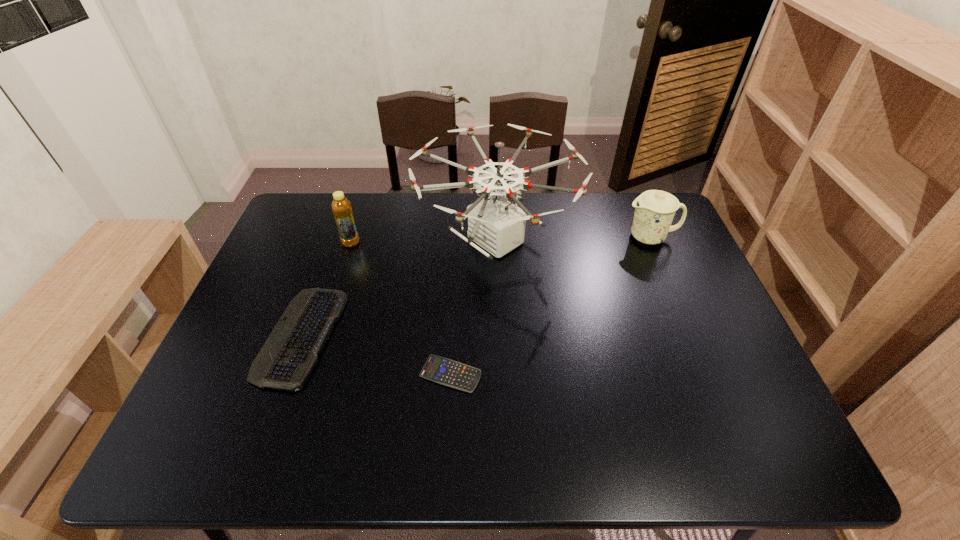
Where is `free space between the bottle and the calculator`? free space between the bottle and the calculator is located at coordinates 400,308.

Locate which object is the closest to the shortest object. Please provide its 2D coordinates. Your answer should be formatted as a tuple, i.e. [(x, y)], where the tuple contains the x and y coordinates of a point satisfying the conditions above.

[(497, 225)]

The width and height of the screenshot is (960, 540). What are the coordinates of `object that is the closest to the rightmost object` in the screenshot? It's located at point(497,225).

The width and height of the screenshot is (960, 540). I want to click on vacant point that satisfies the following two spatial constraints: 1. on the front side of the shortest object; 2. on the right side of the bottle, so click(x=309, y=374).

The width and height of the screenshot is (960, 540). I want to click on free location that satisfies the following two spatial constraints: 1. on the back side of the computer keyboard; 2. on the right side of the tallest object, so click(335, 241).

Identify the location of vacant area that satisfies the following two spatial constraints: 1. on the spout of the rightmost object; 2. on the front side of the tallest object. (652, 241).

Locate an element on the screen. This screenshot has height=540, width=960. free spot that satisfies the following two spatial constraints: 1. on the front side of the computer keyboard; 2. on the right side of the shortest object is located at coordinates (288, 374).